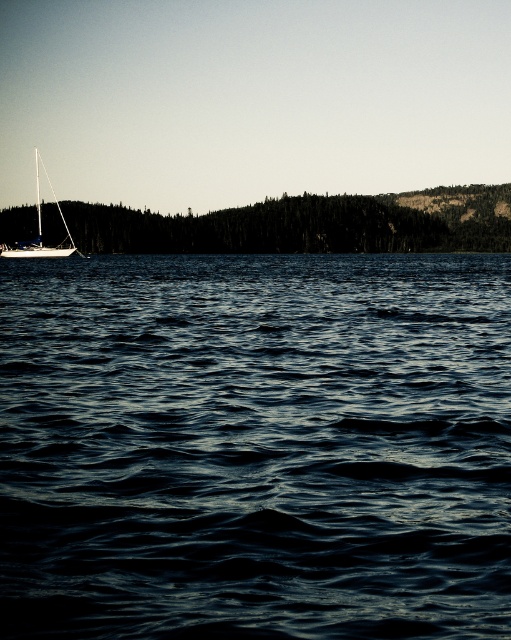
Does dark blue water at center come in front of green matte tree at left?

Yes.

Image resolution: width=511 pixels, height=640 pixels. I want to click on dark blue water at center, so click(x=254, y=445).

I want to click on dark blue water at center, so click(254, 445).

Can you confirm if dark blue water at center is thinner than white matte sailboat at left?

Yes, dark blue water at center is thinner than white matte sailboat at left.

Which is behind, point (82, 387) or point (36, 208)?

The point (36, 208) is more distant.

Describe the element at coordinates (254, 445) in the screenshot. I see `dark blue water at center` at that location.

Find the location of `dark blue water at center`. dark blue water at center is located at coordinates (254, 445).

Does green matte tree at left have a larger size compared to white matte sailboat at left?

No, green matte tree at left is not bigger than white matte sailboat at left.

Can you confirm if green matte tree at left is positioned below white matte sailboat at left?

Correct, green matte tree at left is located below white matte sailboat at left.

Find the location of `green matte tree at left`. green matte tree at left is located at coordinates (307, 225).